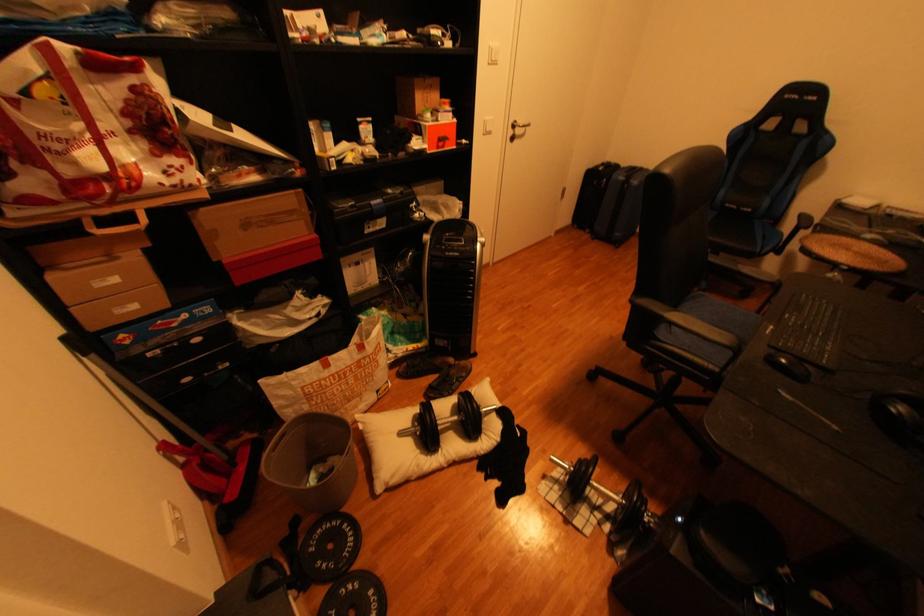
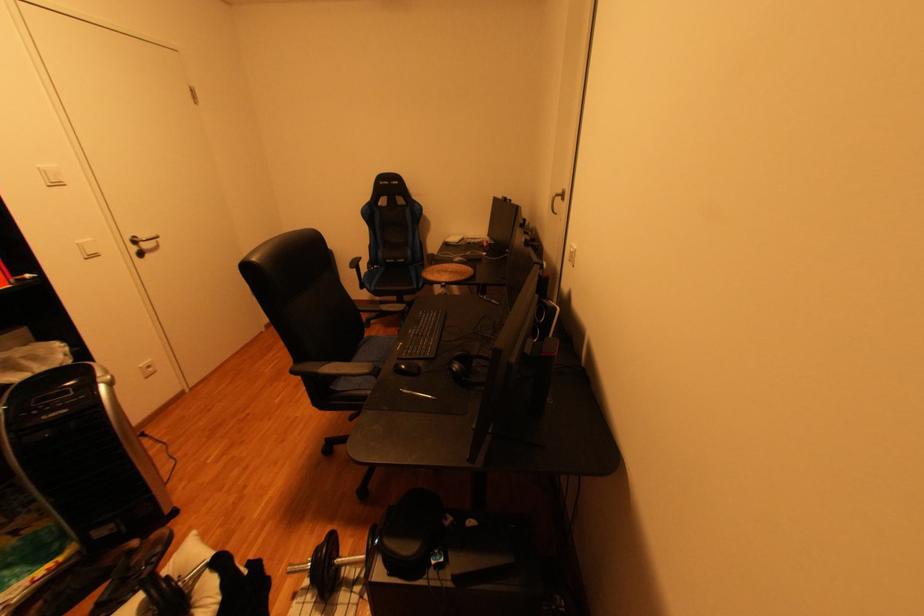
In the second image, find the point that corresponds to point 524,131 in the first image.

(150, 248)